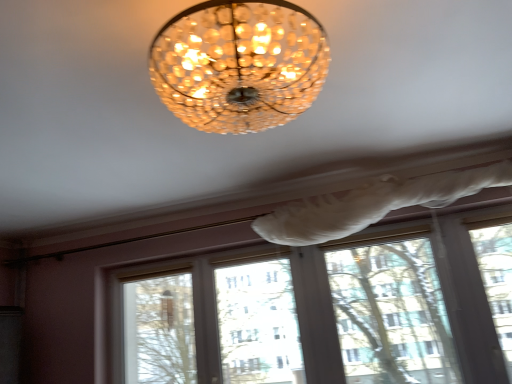
Question: Can you confirm if matte glass chandelier at center is bigger than white plastic window frame at lower right?

Choices:
 (A) yes
 (B) no

Answer: (A)

Question: Is matte glass chandelier at center not inside white plastic window frame at lower right?

Choices:
 (A) no
 (B) yes

Answer: (B)

Question: From a real-world perspective, is matte glass chandelier at center on white plastic window frame at lower right?

Choices:
 (A) no
 (B) yes

Answer: (B)

Question: From the image's perspective, is matte glass chandelier at center on white plastic window frame at lower right?

Choices:
 (A) yes
 (B) no

Answer: (A)

Question: Are matte glass chandelier at center and white plastic window frame at lower right beside each other?

Choices:
 (A) yes
 (B) no

Answer: (B)

Question: From a real-world perspective, is matte glass chandelier at center located beneath white plastic window frame at lower right?

Choices:
 (A) no
 (B) yes

Answer: (A)

Question: Considering the relative positions of white plastic window frame at lower right and matte glass chandelier at center in the image provided, is white plastic window frame at lower right to the left of matte glass chandelier at center from the viewer's perspective?

Choices:
 (A) no
 (B) yes

Answer: (A)

Question: Is white plastic window frame at lower right positioned in front of matte glass chandelier at center?

Choices:
 (A) yes
 (B) no

Answer: (B)

Question: Is there a large distance between white plastic window frame at lower right and matte glass chandelier at center?

Choices:
 (A) yes
 (B) no

Answer: (A)

Question: Does white plastic window frame at lower right have a greater height compared to matte glass chandelier at center?

Choices:
 (A) yes
 (B) no

Answer: (A)

Question: Does white plastic window frame at lower right turn towards matte glass chandelier at center?

Choices:
 (A) yes
 (B) no

Answer: (A)

Question: Does white plastic window frame at lower right have a greater width compared to matte glass chandelier at center?

Choices:
 (A) no
 (B) yes

Answer: (A)

Question: In the image, is matte glass chandelier at center positioned in front of or behind white plastic window frame at lower right?

Choices:
 (A) front
 (B) behind

Answer: (A)